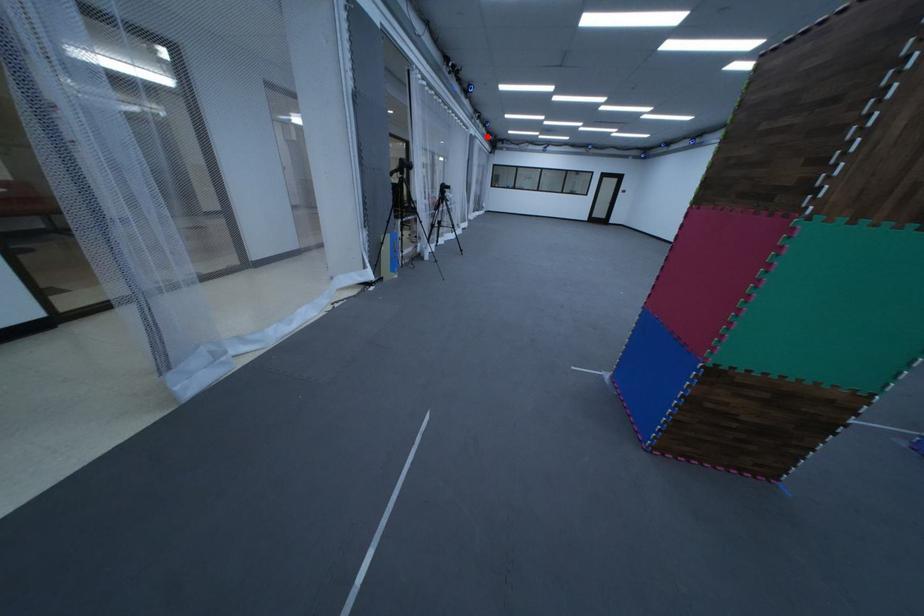
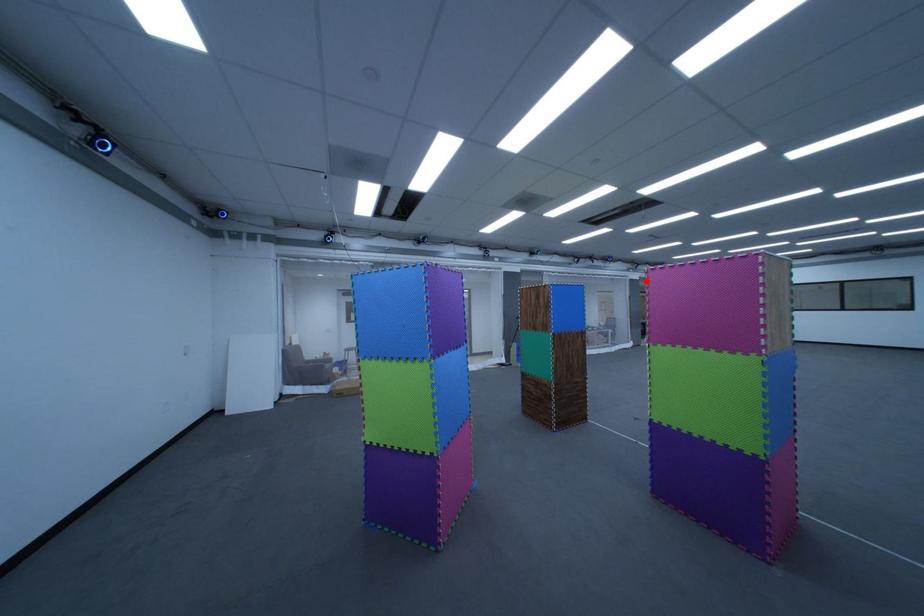
I am providing you with two images of the same scene from different viewpoints. A red point is marked on the first image and another point is marked on the second image. Do the highlighted points in image1 and image2 indicate the same real-world spot?

Yes